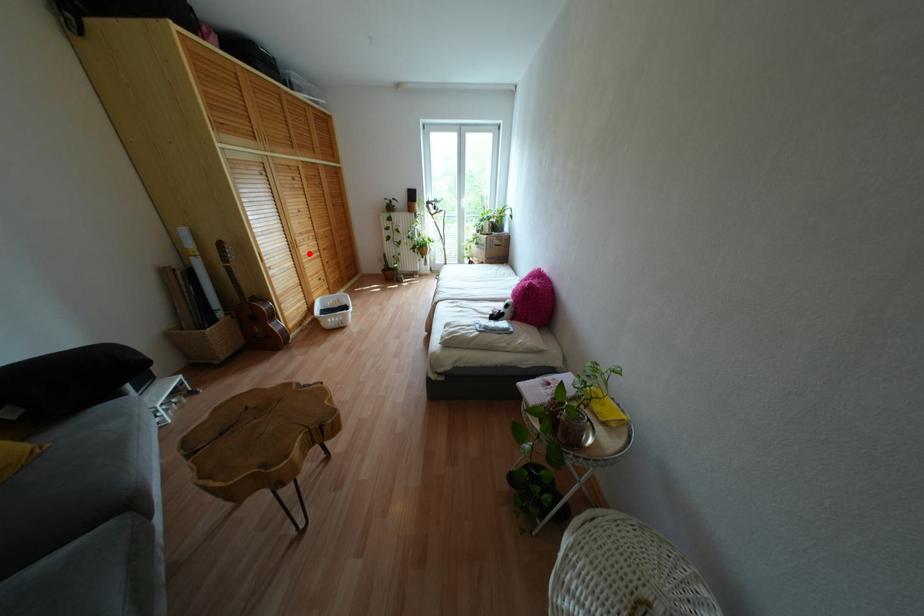
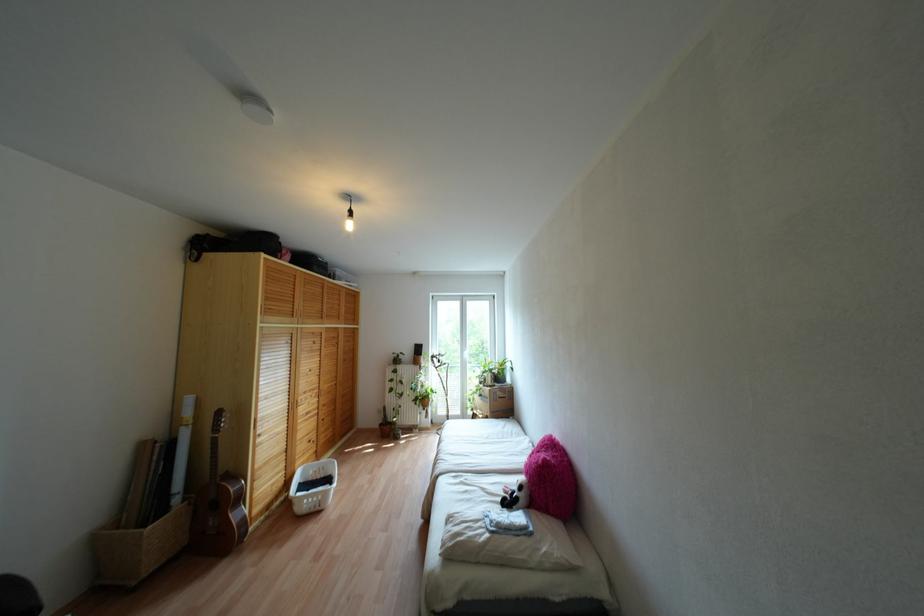
Locate, in the second image, the point that corresponds to the highlighted location in the first image.

(307, 413)